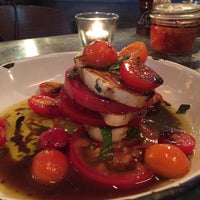
This screenshot has height=200, width=200. What are the coordinates of `glass container` in the screenshot? It's located at (178, 9).